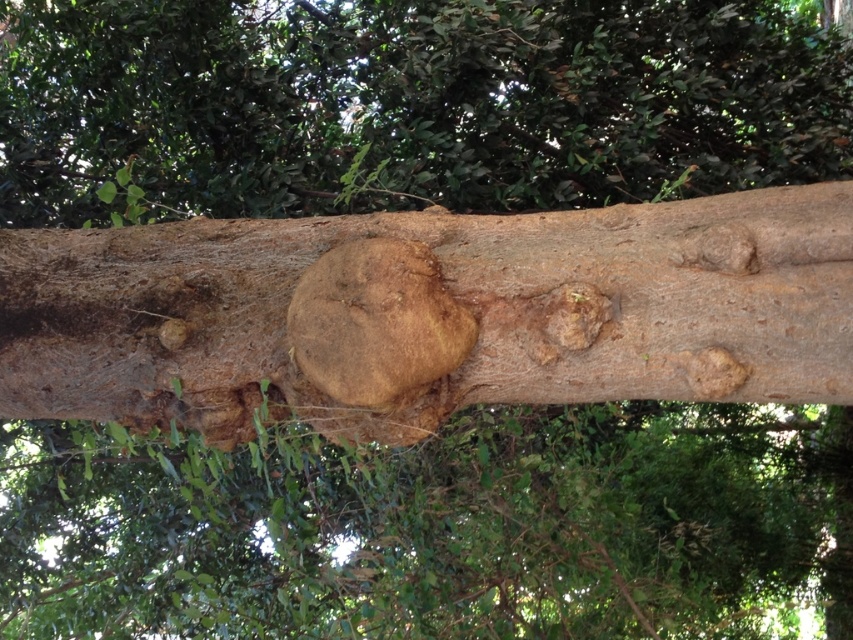
Is smooth brown bark at center positioned in front of brown rough tree knot at center?

That is True.

Which is below, smooth brown bark at center or brown rough tree knot at center?

brown rough tree knot at center

The image size is (853, 640). What do you see at coordinates (430, 314) in the screenshot?
I see `smooth brown bark at center` at bounding box center [430, 314].

The width and height of the screenshot is (853, 640). I want to click on smooth brown bark at center, so [430, 314].